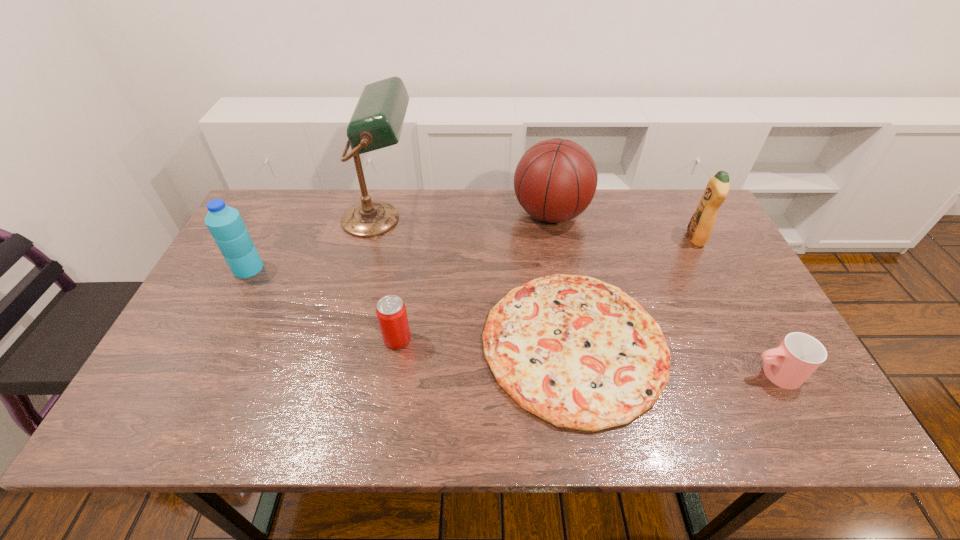
You are a GUI agent. You are given a task and a screenshot of the screen. Output one action in this format:
    pyautogui.click(x=<x>, y=<y>)
    Task: Click on the vacant space situated 0.190m on the label of the detergent
    This screenshot has height=540, width=960.
    Given the screenshot: What is the action you would take?
    pyautogui.click(x=625, y=238)

Where is `free space located on the label of the detergent`? Image resolution: width=960 pixels, height=540 pixels. free space located on the label of the detergent is located at coordinates (660, 238).

Where is `vacant space located 0.180m on the front of the leftmost object`? The height and width of the screenshot is (540, 960). vacant space located 0.180m on the front of the leftmost object is located at coordinates (216, 330).

Find the location of a particular element. The width and height of the screenshot is (960, 540). free point located 0.150m on the back of the third shortest object is located at coordinates (406, 285).

At what (x,y) coordinates should I click in order to perform the action: click on vacant space located on the side of the sixth tallest object with the handle. Please return your answer as a coordinate pair (x, y). The width and height of the screenshot is (960, 540). Looking at the image, I should click on (644, 374).

This screenshot has width=960, height=540. I want to click on vacant area located 0.190m on the side of the sixth tallest object with the handle, so click(666, 374).

The height and width of the screenshot is (540, 960). I want to click on blank space located 0.070m on the side of the sixth tallest object with the handle, so click(718, 374).

This screenshot has height=540, width=960. Identify the location of free space located 0.270m on the right of the pizza. (776, 345).

This screenshot has width=960, height=540. Find the location of `table lamp that is at the far edge`. table lamp that is at the far edge is located at coordinates (377, 121).

This screenshot has height=540, width=960. In order to click on basketball at the far edge in this screenshot , I will do `click(555, 180)`.